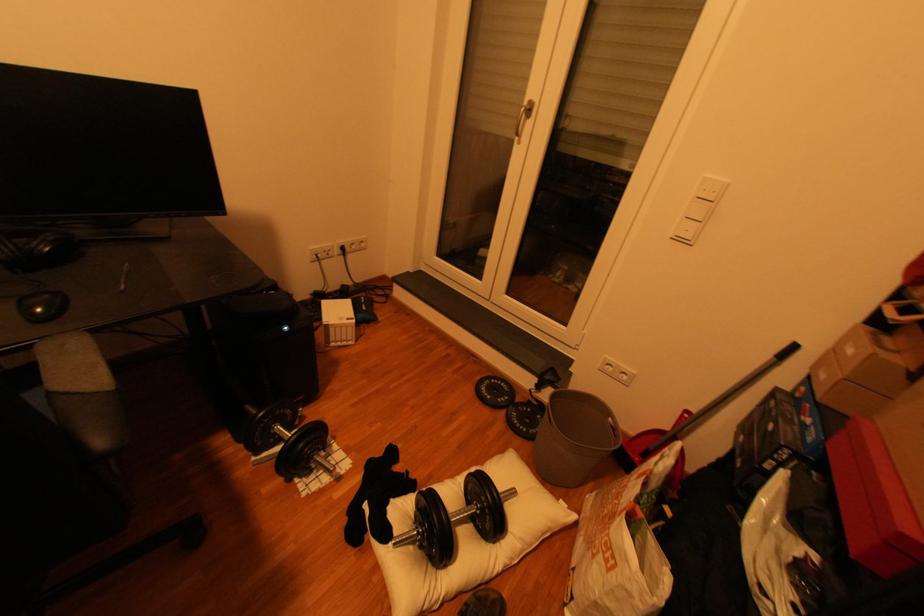
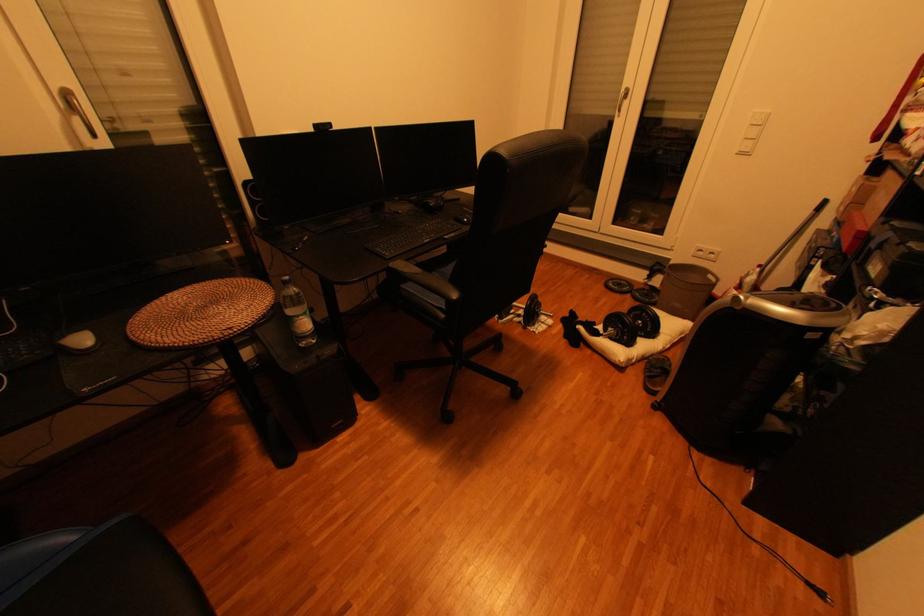
Locate, in the second image, the point that corresponds to the point at 535,430 in the first image.

(658, 301)